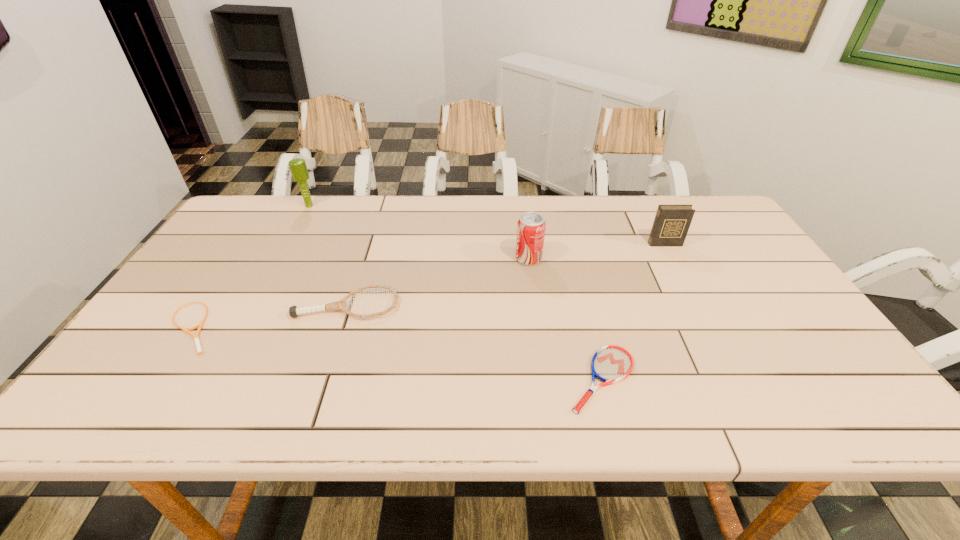
Identify which tennis racket is the second nearest to the farthest object. Please provide its 2D coordinates. Your answer should be formatted as a tuple, i.e. [(x, y)], where the tuple contains the x and y coordinates of a point satisfying the conditions above.

[(196, 337)]

Where is `the closest tennis racket to the shortest object`? This screenshot has height=540, width=960. the closest tennis racket to the shortest object is located at coordinates (294, 311).

Where is `free space that satisfies the following two spatial constraints: 1. on the back side of the fourth tallest object; 2. on the left side of the third farthest object`? free space that satisfies the following two spatial constraints: 1. on the back side of the fourth tallest object; 2. on the left side of the third farthest object is located at coordinates (362, 259).